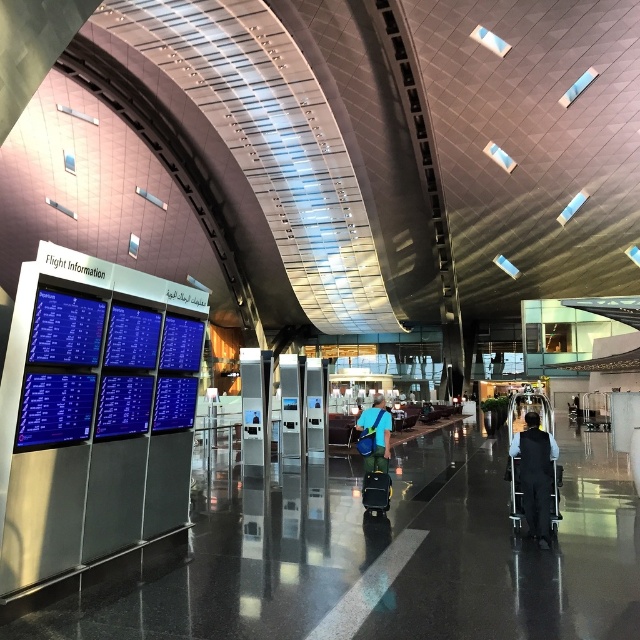
You are a traveler standing in the airport terminal and see the dark blue uniform at center and the black textured suitcase at center. Which object is located higher from the ground?

The dark blue uniform at center is above the black textured suitcase at center, so the dark blue uniform at center is higher from the ground.

You are a traveler at the airport terminal and need to locate your luggage. You see a blue fabric backpack at center and a black textured suitcase at center. Which one is positioned to the right?

The blue fabric backpack at center is positioned to the right of the black textured suitcase at center.

You are a passenger at the airport terminal and you want to check your flight details. You see a dark blue uniform at center and a blue fabric backpack at center. Which item is closer to the flight information display board on the left?

The dark blue uniform at center is located above the blue fabric backpack at center, so the dark blue uniform at center is closer to the flight information display board on the left.